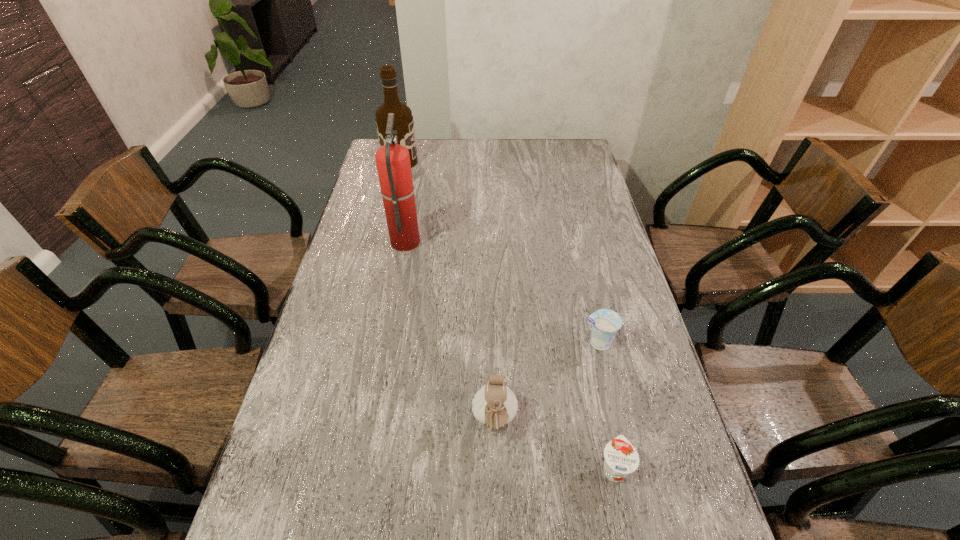
You are a GUI agent. You are given a task and a screenshot of the screen. Output one action in this format:
    pyautogui.click(x=<x>, y=<y>)
    Task: Click on the blank space located on the front-facing side of the second nearest object
    The width and height of the screenshot is (960, 540).
    Given the screenshot: What is the action you would take?
    pyautogui.click(x=496, y=499)

In order to click on free space located on the back of the second shortest object in this screenshot , I will do `click(576, 251)`.

The image size is (960, 540). What are the coordinates of `vacant space located on the back of the shorter yogurt` in the screenshot? It's located at (585, 330).

The width and height of the screenshot is (960, 540). What are the coordinates of `object present at the far edge` in the screenshot? It's located at (403, 120).

Where is `fire extinguisher located in the left edge section of the desktop`? fire extinguisher located in the left edge section of the desktop is located at coordinates (393, 163).

The width and height of the screenshot is (960, 540). Find the location of `alcohol positioned at the left edge`. alcohol positioned at the left edge is located at coordinates (403, 120).

Identify the location of object located in the far left corner section of the desktop. This screenshot has width=960, height=540. (403, 120).

Where is `vacant region at the far edge of the desktop`? This screenshot has height=540, width=960. vacant region at the far edge of the desktop is located at coordinates (517, 145).

This screenshot has height=540, width=960. What are the coordinates of `free space at the left edge of the desktop` in the screenshot? It's located at (358, 199).

Image resolution: width=960 pixels, height=540 pixels. Identify the location of free location at the right edge of the desktop. (675, 478).